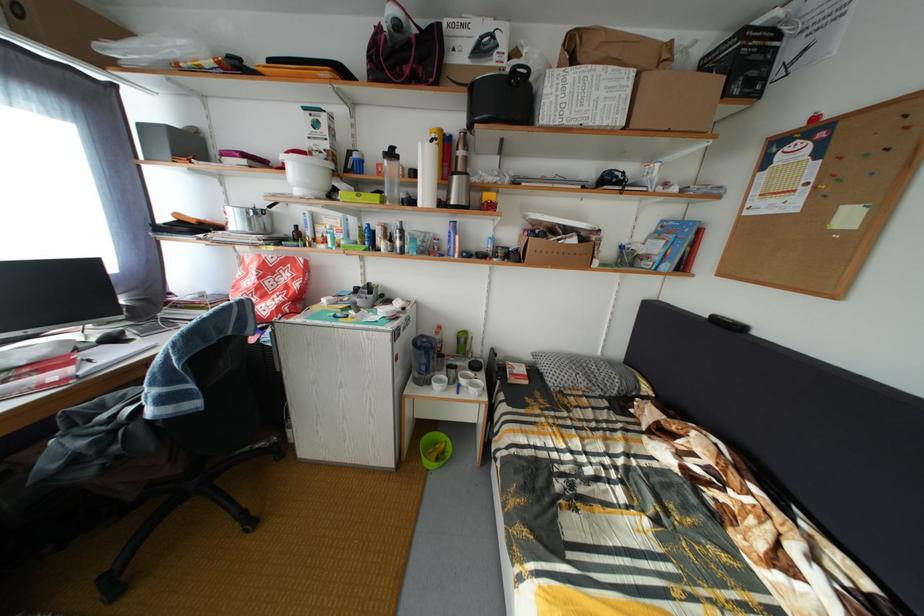
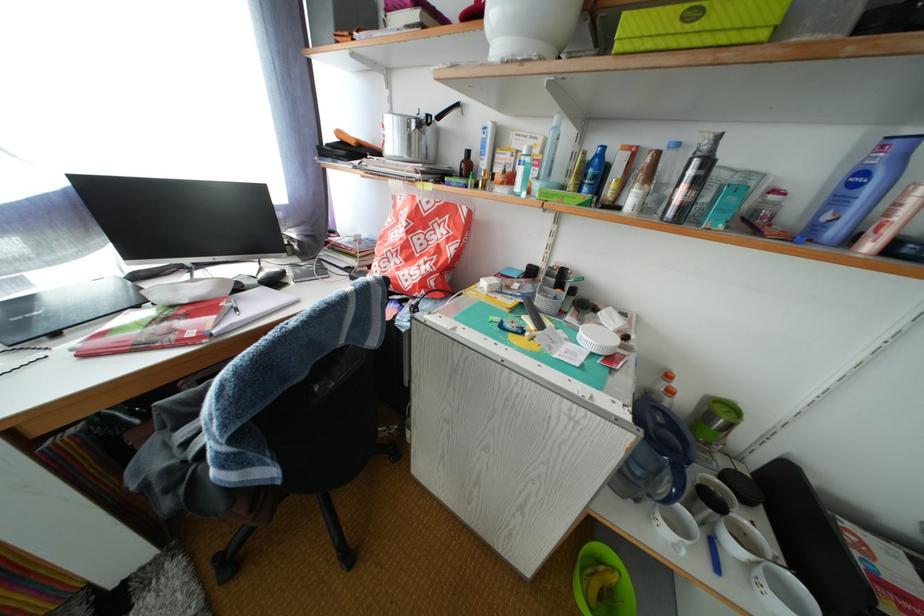
Question: Based on the continuous images, in which direction is the camera rotating? Reply with the corresponding letter.

Choices:
 (A) Left
 (B) Right
 (C) Up
 (D) Down

Answer: (A)